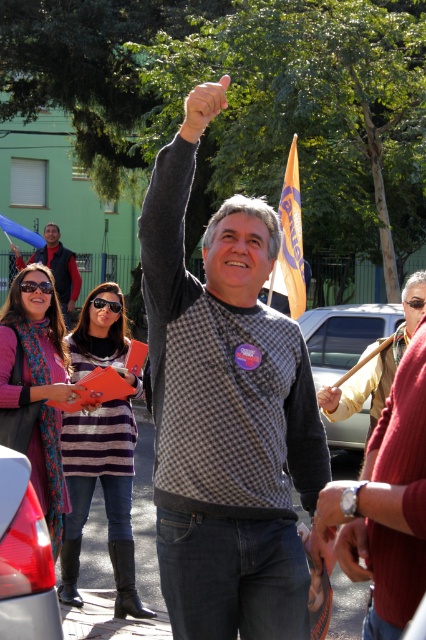
Is matte black jacket at upper left below blue fabric flag at upper left?

Yes, matte black jacket at upper left is below blue fabric flag at upper left.

Is point (19, 268) behind point (31, 236)?

Yes, it is.

The height and width of the screenshot is (640, 426). I want to click on matte black jacket at upper left, so click(60, 269).

The image size is (426, 640). In order to click on matte black jacket at upper left in this screenshot , I will do `click(60, 269)`.

Which is above, leather jacket at center or matte black jacket at upper left?

matte black jacket at upper left is higher up.

Can you confirm if leather jacket at center is positioned to the right of matte black jacket at upper left?

Correct, you'll find leather jacket at center to the right of matte black jacket at upper left.

Is point (405, 296) positioned behind point (51, 232)?

No, it is in front of (51, 232).

The image size is (426, 640). Identify the location of leather jacket at center. (377, 364).

Can you confirm if checkered sweater at center is wider than orange fabric flag at upper center?

Yes.

Is checkered sweater at center taller than orange fabric flag at upper center?

Yes.

Is point (256, 454) less distant than point (279, 211)?

Yes, it is in front of point (279, 211).

The image size is (426, 640). What are the coordinates of `checkered sweater at center` in the screenshot? It's located at (226, 410).